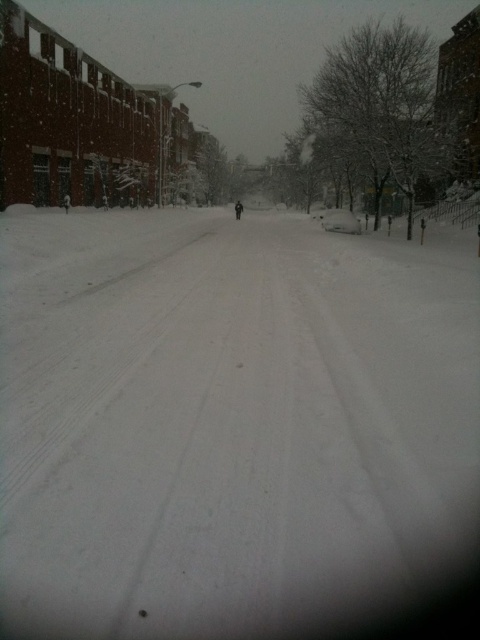
Can you confirm if white powdery snow at center is thinner than black matte person at center?

In fact, white powdery snow at center might be wider than black matte person at center.

Does white powdery snow at center have a larger size compared to black matte person at center?

Yes.

Does point (382, 397) come behind point (242, 205)?

No.

You are a GUI agent. You are given a task and a screenshot of the screen. Output one action in this format:
    pyautogui.click(x=<x>, y=<y>)
    Task: Click on the white powdery snow at center
    The image size is (480, 640).
    Given the screenshot: What is the action you would take?
    pyautogui.click(x=228, y=412)